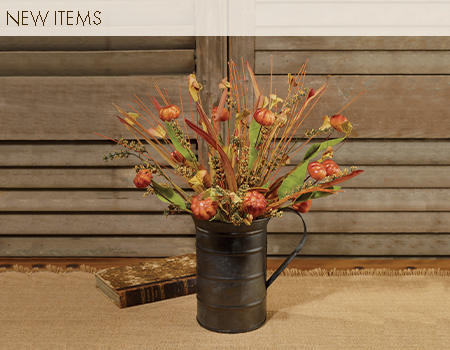
This screenshot has height=350, width=450. In order to click on shutters in this screenshot , I will do `click(69, 187)`.